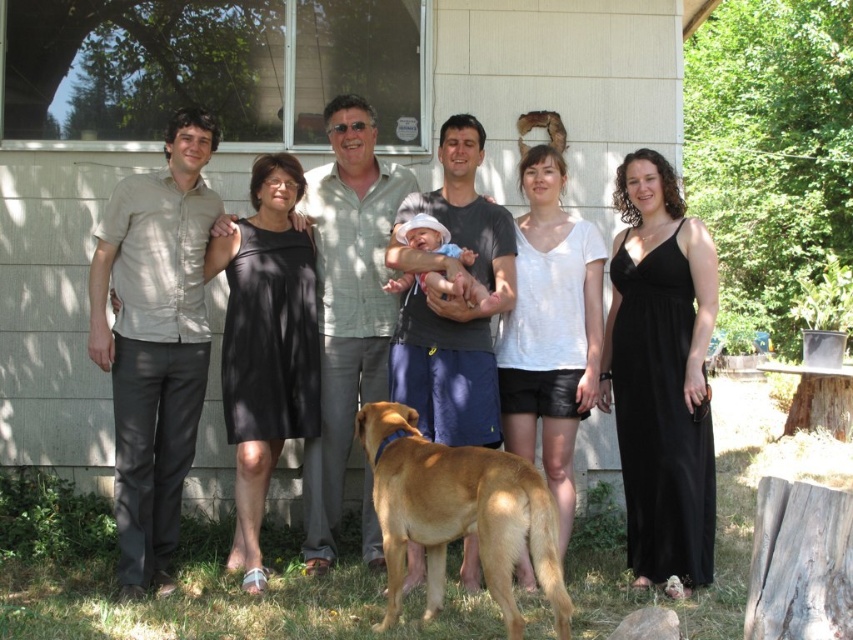
Which is more to the left, matte black dress at center or golden fur dog at lower center?

From the viewer's perspective, golden fur dog at lower center appears more on the left side.

Who is lower down, matte black dress at center or golden fur dog at lower center?

Positioned lower is golden fur dog at lower center.

Which is behind, point (349, 108) or point (492, 579)?

The point (349, 108) is more distant.

Where is `matte black dress at center`? matte black dress at center is located at coordinates (697, 394).

Is point (544, 582) behind point (418, 225)?

No, it is not.

Does golden fur dog at lower center have a smaller size compared to soft pink fabric baby at center?

No, golden fur dog at lower center is not smaller than soft pink fabric baby at center.

This screenshot has height=640, width=853. What do you see at coordinates (459, 513) in the screenshot?
I see `golden fur dog at lower center` at bounding box center [459, 513].

Where is `golden fur dog at lower center`? The image size is (853, 640). golden fur dog at lower center is located at coordinates (459, 513).

Between matte black dress at center and soft pink fabric baby at center, which one has less height?

soft pink fabric baby at center is shorter.

Is point (679, 406) in front of point (410, 244)?

Yes, it is in front of point (410, 244).

Who is more forward, (519, 220) or (447, 292)?

Positioned in front is point (447, 292).

Locate an element on the screen. The image size is (853, 640). matte black dress at center is located at coordinates (697, 394).